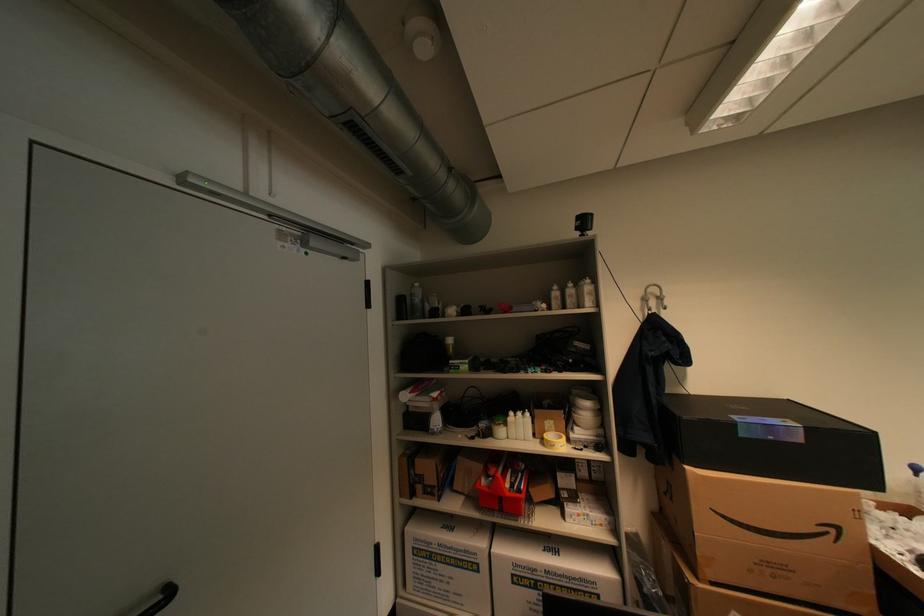
Locate an element on the screen. This screenshot has height=616, width=924. red plastic caddy is located at coordinates (503, 485).